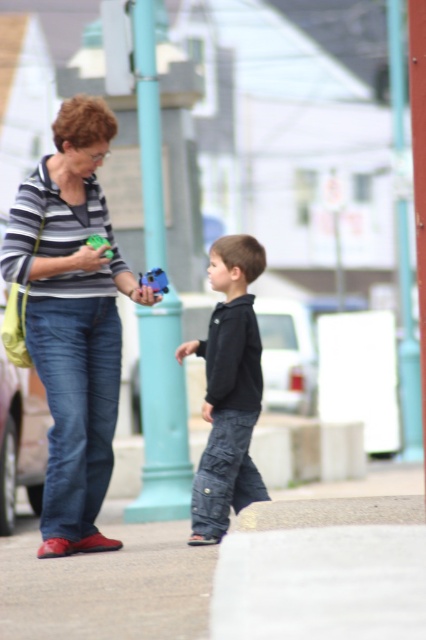
You are a photographer trying to capture a candid shot of the scene. You notice the matte striped shirt at center and the matte green plastic toy at left. Which object should you focus on to ensure the subject in the foreground is sharp?

The matte striped shirt at center is closer to the viewer than the matte green plastic toy at left, so focusing on the matte striped shirt at center will ensure the foreground subject is sharp.